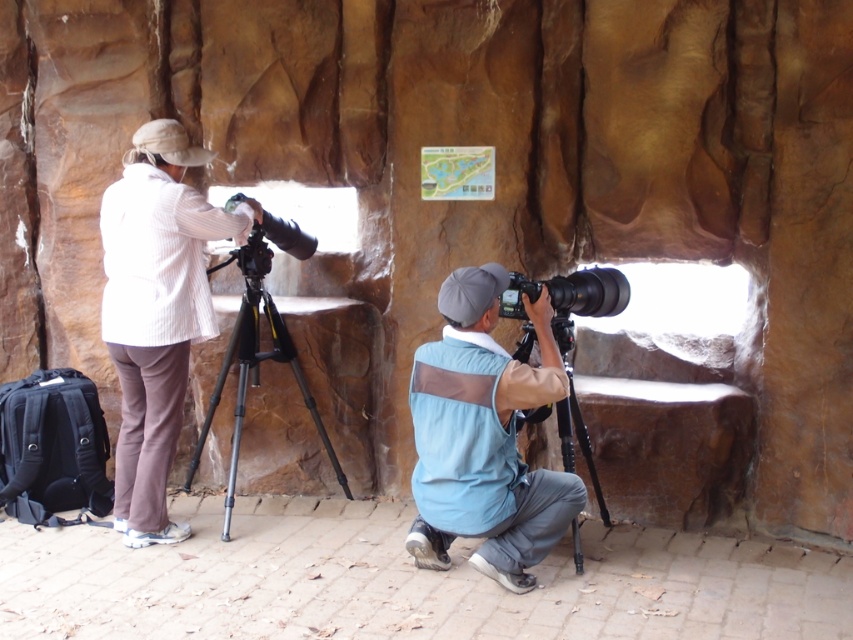
Question: Which of these objects is positioned closest to the light blue mesh vest at center?

Choices:
 (A) black plastic camera at center
 (B) black metal tripod at lower center

Answer: (B)

Question: Among these objects, which one is nearest to the camera?

Choices:
 (A) light blue mesh vest at center
 (B) black metal tripod at lower center
 (C) black metal tripod at center
 (D) white textured jacket at upper left

Answer: (A)

Question: Considering the relative positions of white textured jacket at upper left and black metal tripod at lower center in the image provided, where is white textured jacket at upper left located with respect to black metal tripod at lower center?

Choices:
 (A) above
 (B) below

Answer: (A)

Question: Which object appears closest to the camera in this image?

Choices:
 (A) black metal tripod at lower center
 (B) black metal tripod at center
 (C) light blue mesh vest at center

Answer: (C)

Question: Is black metal tripod at center positioned in front of black metal tripod at lower center?

Choices:
 (A) yes
 (B) no

Answer: (B)

Question: Can you confirm if light blue mesh vest at center is smaller than black plastic camera at center?

Choices:
 (A) no
 (B) yes

Answer: (A)